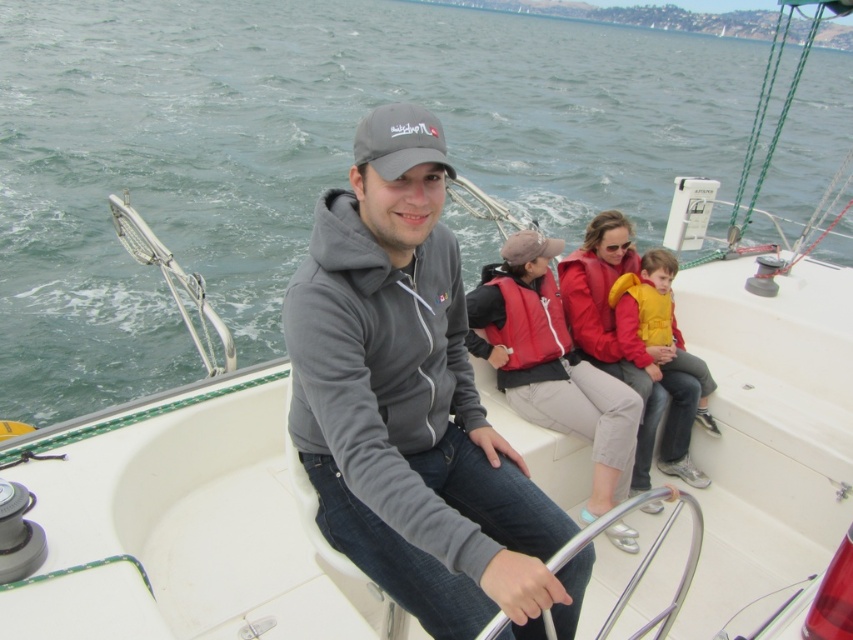
You are a passenger on the sailboat and need to retrieve the matte red life vest at center. The green water at center is splashing. Which direction should you move to avoid the splashing water while reaching the life vest?

The green water at center is to the right of the matte red life vest at center. To avoid the splashing water, you should move to the left side of the life vest.

You are a passenger on the sailboat and need to locate the yellow fleece vest at center and the matte red life vest at center. According to the scene, which one is positioned more to the right?

The yellow fleece vest at center is positioned more to the right than the matte red life vest at center.

You are a passenger on the sailboat and want to locate the yellow fleece vest at center. Where would you look relative to the helm and the steering wheel?

The yellow fleece vest at center is located at point (660, 356), which is to the right and slightly forward of the helm and steering wheel.